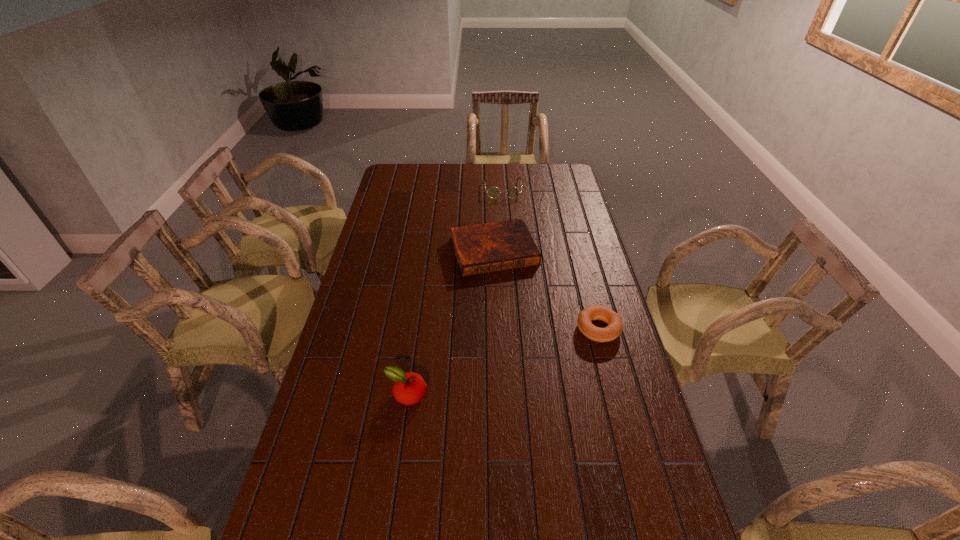
The image size is (960, 540). In order to click on free location located on the lenses of the spectacles in this screenshot , I will do `click(506, 235)`.

The width and height of the screenshot is (960, 540). I want to click on free space located on the spine side of the second farthest object, so click(514, 299).

In order to click on vacant space situated on the spine side of the second farthest object in this screenshot , I will do `click(530, 339)`.

The height and width of the screenshot is (540, 960). Find the location of `vacant space situated on the spine side of the second farthest object`. vacant space situated on the spine side of the second farthest object is located at coordinates (509, 285).

Find the location of a particular element. Image resolution: width=960 pixels, height=540 pixels. object that is at the far edge is located at coordinates pyautogui.click(x=513, y=192).

In order to click on object located at the right edge in this screenshot , I will do `click(613, 330)`.

At what (x,y) coordinates should I click in order to perform the action: click on vacant space at the far edge of the desktop. Please return your answer as a coordinate pair (x, y). Image resolution: width=960 pixels, height=540 pixels. Looking at the image, I should click on (502, 181).

Identify the location of blank space at the near edge of the desktop. (390, 518).

Identify the location of vacant space at the left edge of the desktop. (367, 324).

Identify the location of free spot at the right edge of the desktop. (587, 297).